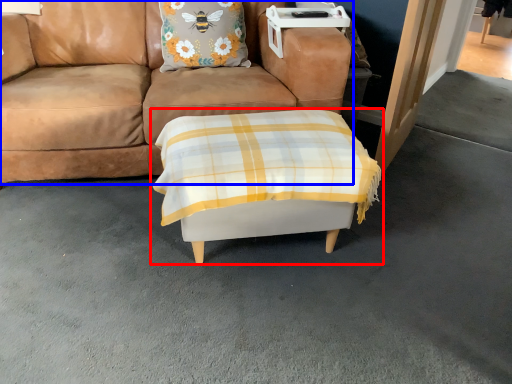
Question: Which of the following is the farthest to the observer, table (highlighted by a red box) or studio couch (highlighted by a blue box)?

Choices:
 (A) table
 (B) studio couch

Answer: (B)